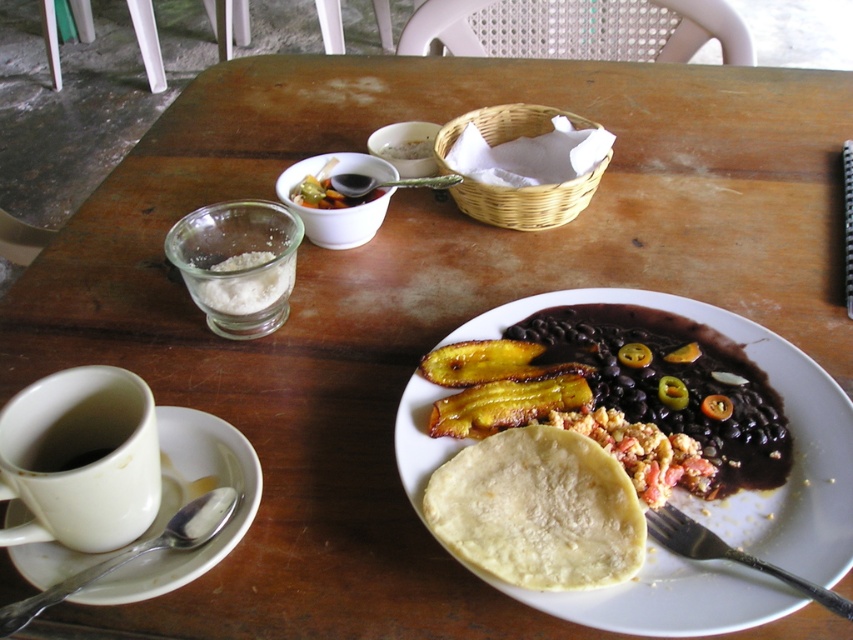
Can you confirm if matte white tortilla at lower center is shorter than yellow matte tortilla at center?

No, matte white tortilla at lower center is not shorter than yellow matte tortilla at center.

The image size is (853, 640). What are the coordinates of `matte white tortilla at lower center` in the screenshot? It's located at pos(788,426).

Is point (630, 291) behind point (508, 436)?

Yes.

You are a GUI agent. You are given a task and a screenshot of the screen. Output one action in this format:
    pyautogui.click(x=<x>, y=<y>)
    Task: Click on the matte white tortilla at lower center
    The height and width of the screenshot is (640, 853).
    Given the screenshot: What is the action you would take?
    pyautogui.click(x=788, y=426)

Which of these two, silver metallic spoon at lower left or black metal fork at lower right, stands shorter?

Standing shorter between the two is black metal fork at lower right.

Is point (170, 518) positioned in front of point (677, 509)?

No, it is behind (677, 509).

Locate an element on the screen. Image resolution: width=853 pixels, height=640 pixels. silver metallic spoon at lower left is located at coordinates (132, 554).

Who is more distant from viewer, (x=115, y=550) or (x=219, y=516)?

The point (x=219, y=516) is behind.

Who is positioned more to the left, white ceramic cup at lower left or silver metallic spoon at lower left?

From the viewer's perspective, white ceramic cup at lower left appears more on the left side.

Which is in front, point (152, 589) or point (207, 529)?

Point (152, 589) is in front.

Find the location of a particular element. The height and width of the screenshot is (640, 853). white ceramic cup at lower left is located at coordinates (186, 502).